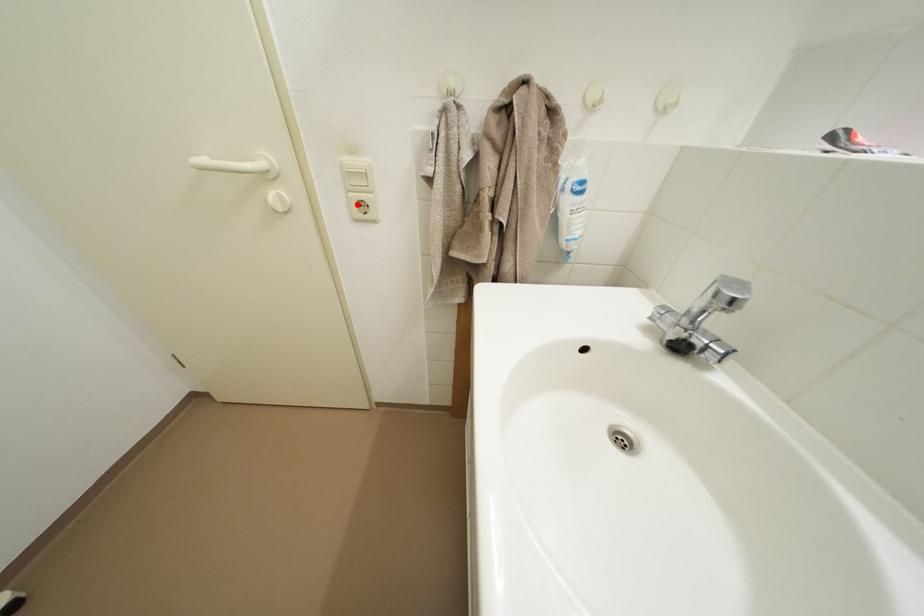
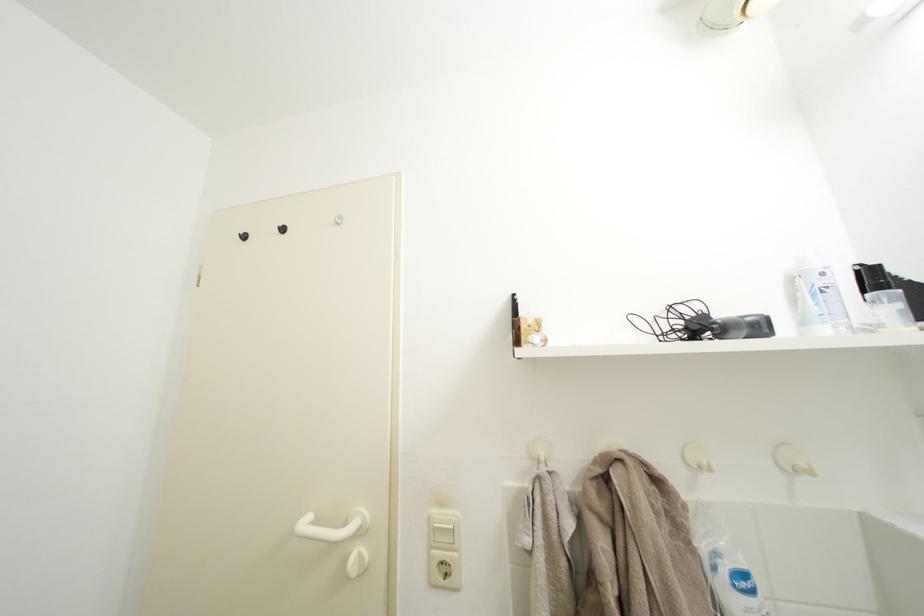
In the second image, find the point that corresponds to the highlighted location in the first image.

(439, 562)